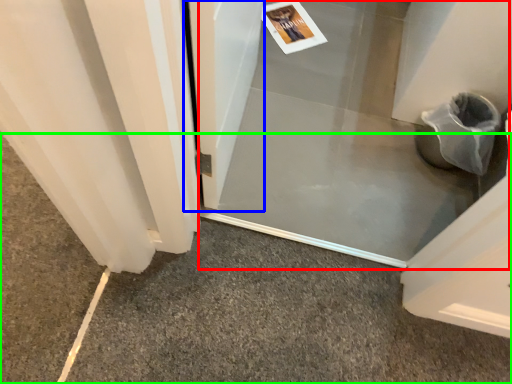
Question: Based on their relative distances, which object is nearer to screen door (highlighted by a red box)? Choose from screen door (highlighted by a blue box) and concrete (highlighted by a green box).

Choices:
 (A) screen door
 (B) concrete

Answer: (A)